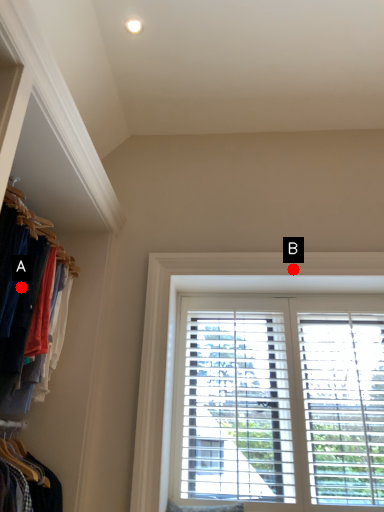
Question: Two points are circled on the image, labeled by A and B beside each circle. Among these points, which one is farthest from the camera?

Choices:
 (A) A is further
 (B) B is further

Answer: (B)